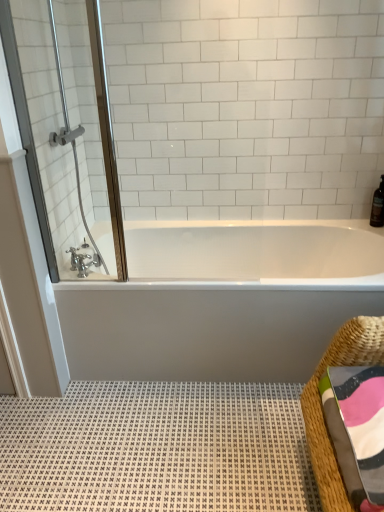
Where is `vacant space to the left of brown glass bottle at upper right`? vacant space to the left of brown glass bottle at upper right is located at coordinates [x=351, y=226].